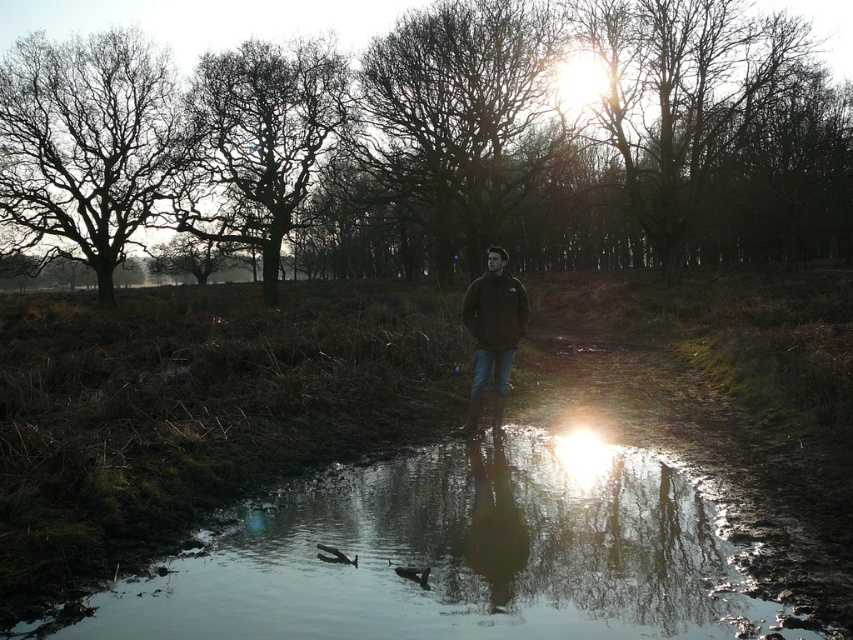
You are standing on the dirt path in the scene and want to walk towards the point labeled as point (331, 554). If you continue walking straight ahead, will you eventually reach the point labeled as point (474, 196)?

No, because point (474, 196) is behind point (331, 554), so walking towards point (331, 554) would take you away from point (474, 196).

You are standing on the dirt path and want to take a photo of the dark brown bark tree at upper left and the shiny reflective water at center. Which object should you focus on first if you want to capture both in a single frame without moving the camera?

You should focus on the dark brown bark tree at upper left first because it is taller than the shiny reflective water at center, so it will appear higher in the frame.